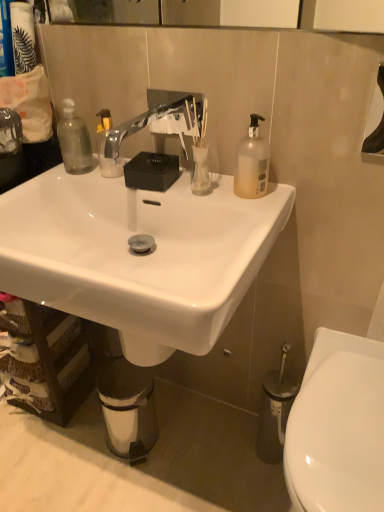
Find the location of a particular element. Image resolution: width=384 pixels, height=512 pixels. free area below white glossy sink at center (from a real-world perspective) is located at coordinates (156, 471).